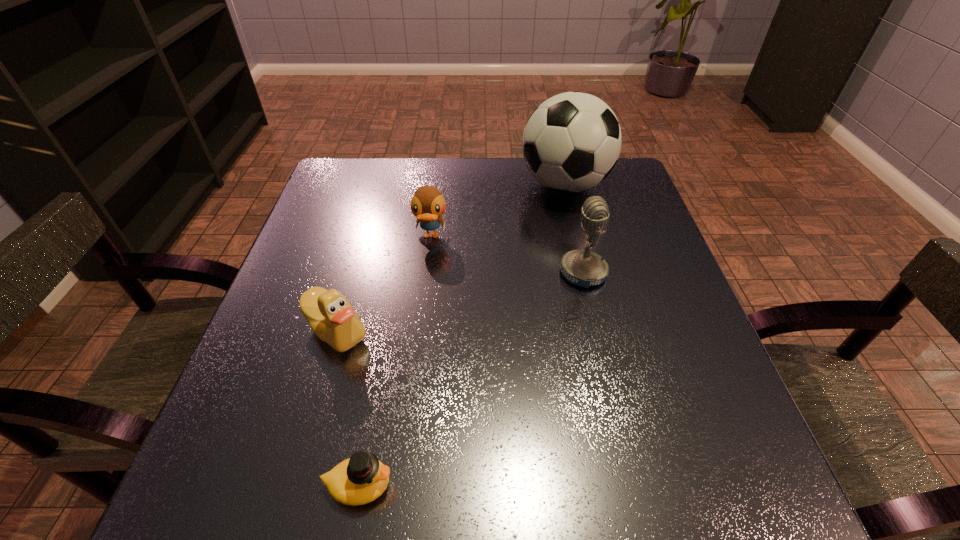
The image size is (960, 540). I want to click on object at the far right corner, so click(x=572, y=141).

You are a GUI agent. You are given a task and a screenshot of the screen. Output one action in this format:
    pyautogui.click(x=<x>, y=<y>)
    Task: Click on the free space at the far edge
    The height and width of the screenshot is (540, 960).
    Given the screenshot: What is the action you would take?
    (x=456, y=168)

Identify the location of free space at the near edge. The height and width of the screenshot is (540, 960). (315, 511).

The image size is (960, 540). What are the coordinates of `free space at the left edge of the desktop` in the screenshot? It's located at (290, 309).

Identify the location of free space at the right edge. (625, 315).

The image size is (960, 540). What are the coordinates of `vacant region at the far right corner` in the screenshot? It's located at (613, 170).

The width and height of the screenshot is (960, 540). I want to click on free region at the near right corner, so click(680, 503).

The width and height of the screenshot is (960, 540). I want to click on empty space between the shortest object and the third farthest object, so click(x=471, y=379).

Image resolution: width=960 pixels, height=540 pixels. I want to click on free space between the farthest duck and the shortest duck, so click(395, 361).

Find the location of `free area in between the second farthest object and the farthest object`. free area in between the second farthest object and the farthest object is located at coordinates (497, 211).